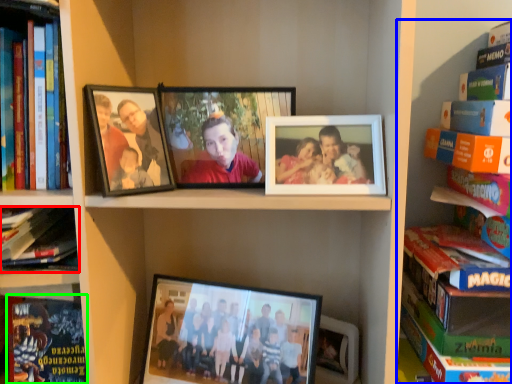
Question: Which object is the farthest from book (highlighted by a red box)? Choose among these: book (highlighted by a blue box) or paperback book (highlighted by a green box).

Choices:
 (A) book
 (B) paperback book

Answer: (A)